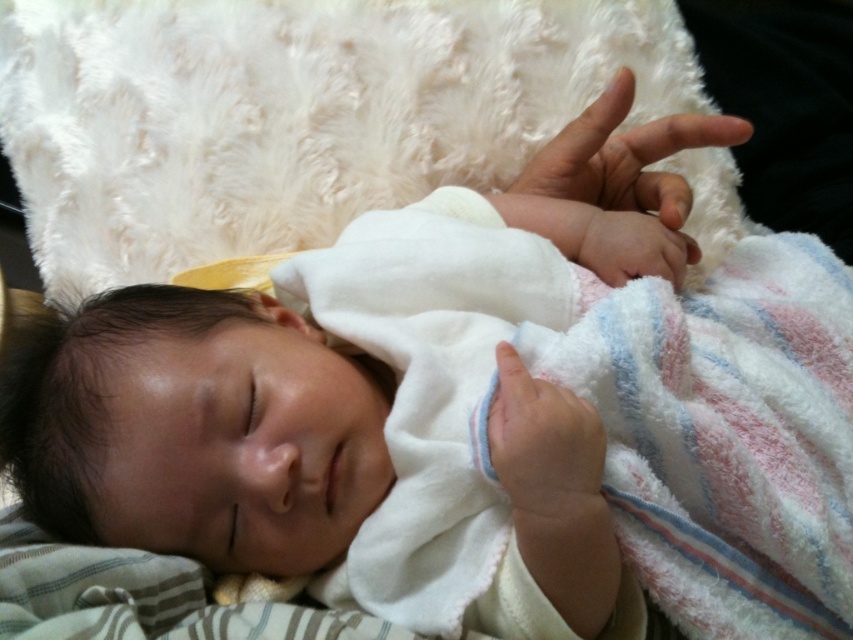
You are a pediatrician examining the baby. You notice the pink soft skin at center and the smooth white hand at center. How far apart are these two areas on the baby?

The distance between the pink soft skin at center and the smooth white hand at center is 8.81 inches.

You are a photographer taking a closeup shot of the sleeping baby. You need to focus on the pink soft skin at center and the smooth white hand at center. Which object should you focus on first if you want to capture both in sharp focus?

The pink soft skin at center is above the smooth white hand at center, so you should focus on the pink soft skin at center first to ensure both are in sharp focus.

In the scene shown: You are a pediatrician examining the baby in the image. You need to determine the position of the pink soft skin at center relative to the smooth white hand at center. Which one is higher up?

The pink soft skin at center is taller than smooth white hand at center, so the pink soft skin at center is higher up in the image.